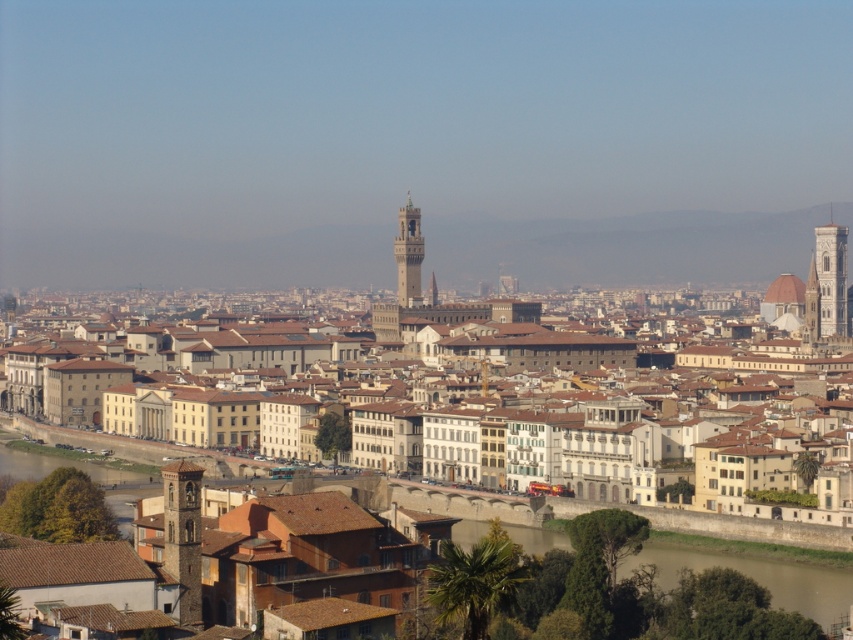
Looking at this image, you are standing at the point marked by the coordinate point (184,356) in the image. What type of buildings are you surrounded by?

The point (184,356) marks brown stone buildings at center, so you are surrounded by brown stone buildings at center.

You are a tourist standing in Florence, Italy, and you want to walk from the brown stone buildings at center to the stone bell tower at lower left. Given that the distance between them is 639.08 feet, how many minutes would it take you to walk there at a normal pace of 3 miles per hour?

Walking at 3 miles per hour, it would take approximately 7.5 minutes to cover the 639.08 feet distance between the brown stone buildings at center and the stone bell tower at lower left.